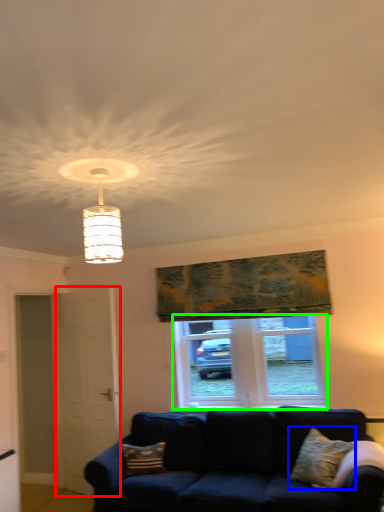
Question: Considering the real-world distances, which object is closest to screen door (highlighted by a red box)? pillow (highlighted by a blue box) or window (highlighted by a green box).

Choices:
 (A) pillow
 (B) window

Answer: (B)